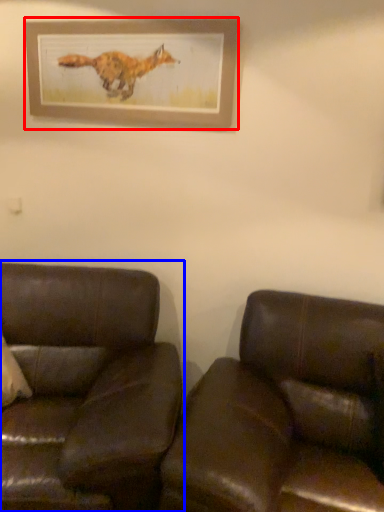
Question: Among these objects, which one is nearest to the camera, picture frame (highlighted by a red box) or studio couch (highlighted by a blue box)?

Choices:
 (A) picture frame
 (B) studio couch

Answer: (B)